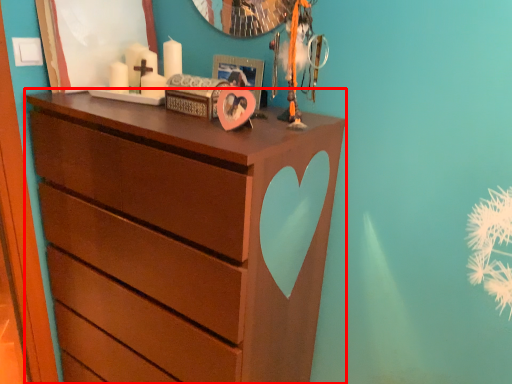
Question: From the image's perspective, what is the correct spatial positioning of chest of drawers (annotated by the red box) in reference to picture frame?

Choices:
 (A) below
 (B) above

Answer: (A)